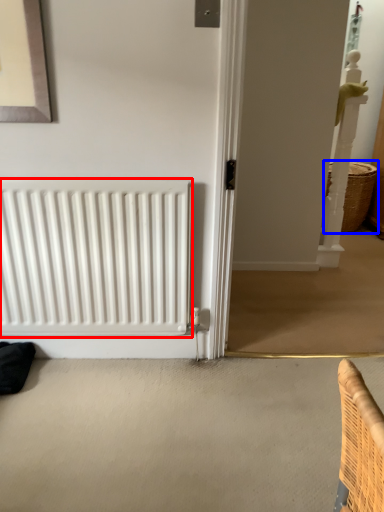
Question: Which object appears closest to the camera in this image, radiator (highlighted by a red box) or basket (highlighted by a blue box)?

Choices:
 (A) radiator
 (B) basket

Answer: (A)